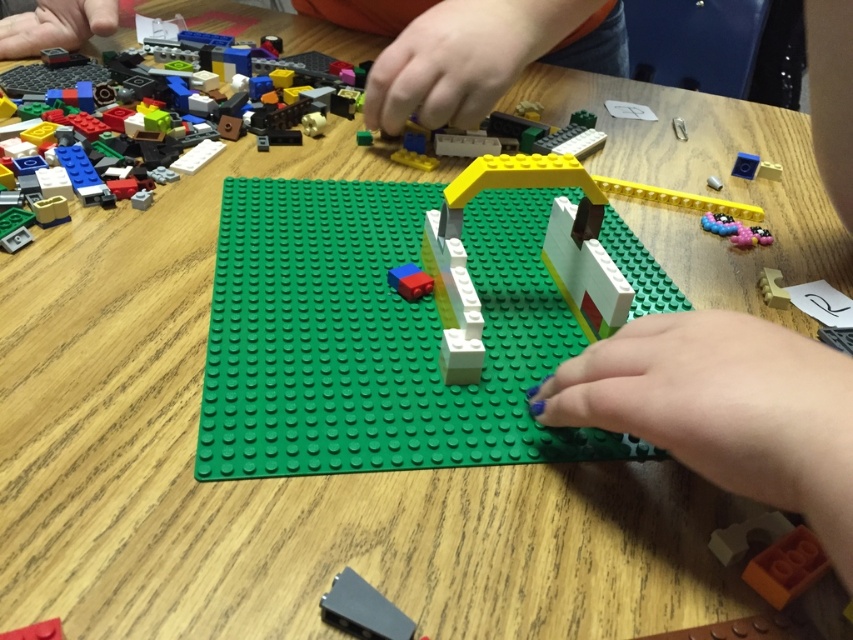
You are a LEGO builder who needs to pick up the translucent plastic bricks at upper left and the matte blue brick at center. The robot arm has a maximum reach of 30 inches. Can the robot arm pick up both bricks without moving its position?

The distance between the translucent plastic bricks at upper left and the matte blue brick at center is 28.49 inches. Since the robot arm can reach up to 30 inches, it can pick up both bricks without moving its position.

You are a LEGO builder trying to determine if the white matte house at center can support the matte blue brick at center on top of it. Based on their sizes, would the blue brick be at risk of falling off?

The white matte house at center is taller than the matte blue brick at center, so placing the blue brick on top would likely be stable as the house provides a solid base. However, since the blue brick is smaller in height, it might not cover the entire top surface, but it won

You are a LEGO builder who needs to place a new red brick on top of the white matte house at center without knocking over the matte blue brick at center. Based on their positions, is this possible?

The white matte house at center is in front of the matte blue brick at center, so placing the red brick on top of the white matte house at center should be possible without affecting the blue brick since they are positioned in different planes.